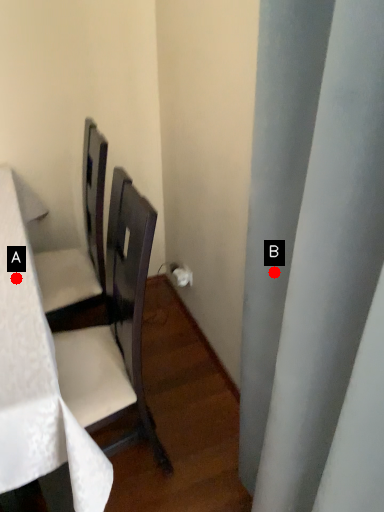
Question: Two points are circled on the image, labeled by A and B beside each circle. Which point is closer to the camera?

Choices:
 (A) A is closer
 (B) B is closer

Answer: (B)